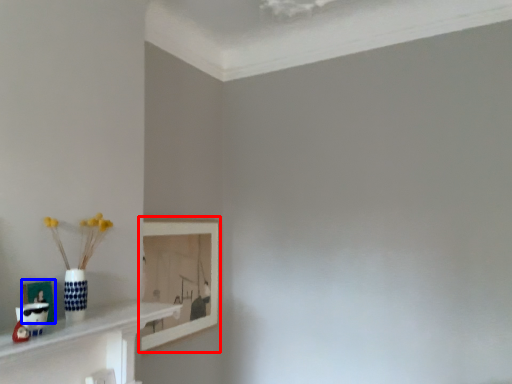
Question: Which object appears closest to the camera in this image, picture frame (highlighted by a red box) or picture frame (highlighted by a blue box)?

Choices:
 (A) picture frame
 (B) picture frame

Answer: (B)